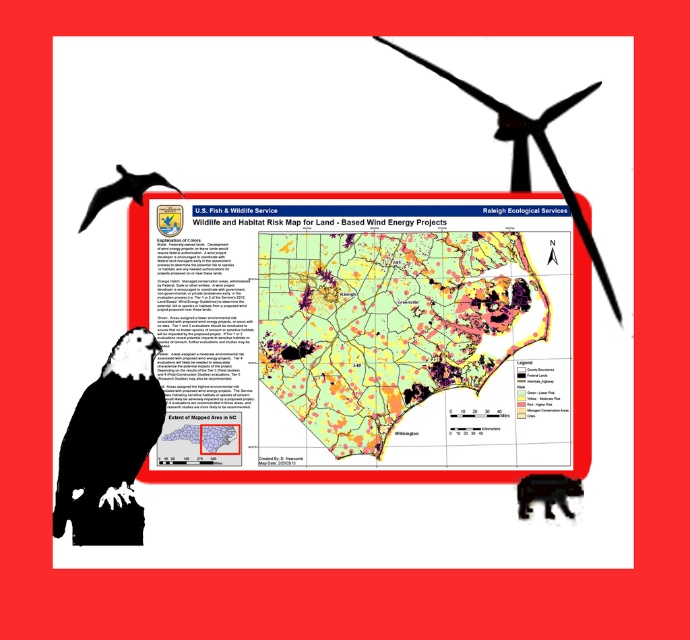
Question: Can you confirm if black matte eagle at lower left is positioned to the left of black fur bear at lower left?

Choices:
 (A) no
 (B) yes

Answer: (B)

Question: Can you confirm if yellow paper map at center is positioned to the right of black matte eagle at lower left?

Choices:
 (A) yes
 (B) no

Answer: (A)

Question: Is yellow paper map at center above black fur bear at lower left?

Choices:
 (A) yes
 (B) no

Answer: (A)

Question: Considering the real-world distances, which object is closest to the silhouette glossy eagle at lower left?

Choices:
 (A) black matte eagle at lower left
 (B) black fur bear at lower left

Answer: (A)

Question: Which point is closer to the camera?

Choices:
 (A) (135, 445)
 (B) (346, 365)
 (C) (552, 163)

Answer: (A)

Question: Which point is closer to the camera taking this photo?

Choices:
 (A) (346, 417)
 (B) (90, 458)

Answer: (B)